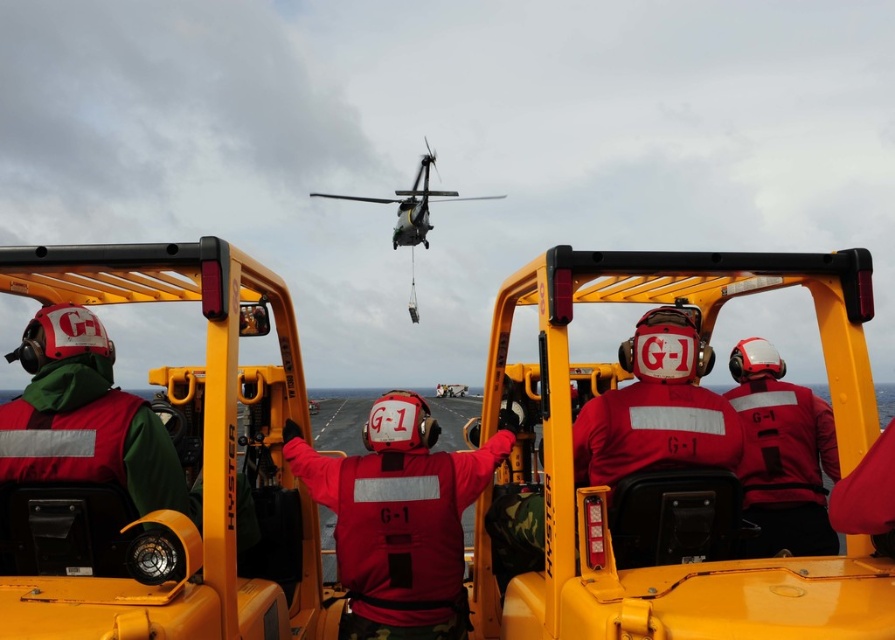
Question: Is red matte jacket at center thinner than metallic gray helicopter at upper center?

Choices:
 (A) yes
 (B) no

Answer: (A)

Question: Which object is positioned farthest from the metallic gray helicopter at upper center?

Choices:
 (A) red matte jacket at center
 (B) red matte helmet at center

Answer: (A)

Question: Which point appears farthest from the camera in this image?

Choices:
 (A) (405, 218)
 (B) (797, 481)

Answer: (A)

Question: Is the position of red matte helmet at center less distant than that of metallic gray helicopter at upper center?

Choices:
 (A) no
 (B) yes

Answer: (B)

Question: Can you confirm if red matte jacket at center is positioned below metallic gray helicopter at upper center?

Choices:
 (A) no
 (B) yes

Answer: (B)

Question: Which point is closer to the camera taking this photo?

Choices:
 (A) (768, 356)
 (B) (422, 179)

Answer: (A)